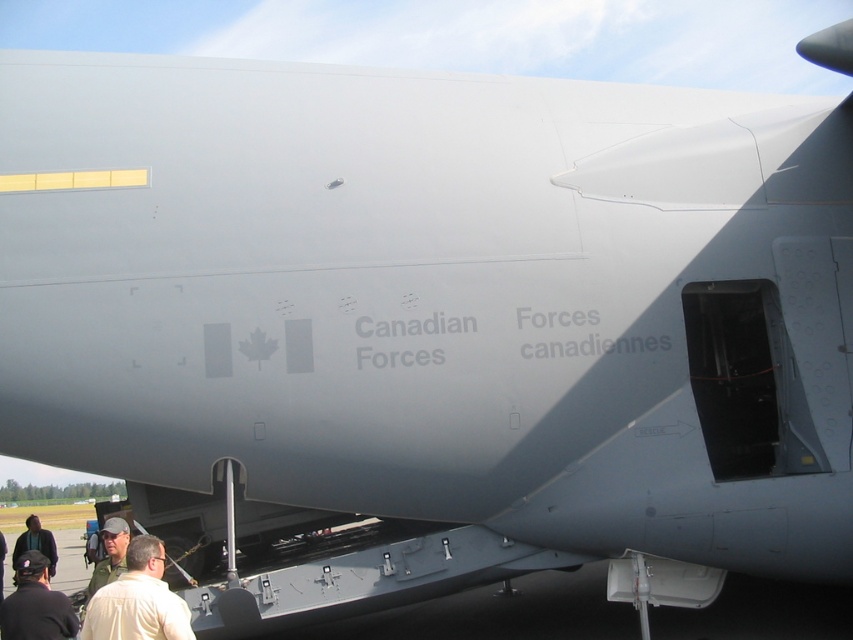
Looking at this image, does black fabric at lower left appear on the right side of camouflage fabric cap at lower left?

Incorrect, black fabric at lower left is not on the right side of camouflage fabric cap at lower left.

Is black fabric at lower left closer to camera compared to camouflage fabric cap at lower left?

That is True.

This screenshot has height=640, width=853. What do you see at coordinates (35, 604) in the screenshot? I see `black fabric at lower left` at bounding box center [35, 604].

Locate an element on the screen. This screenshot has width=853, height=640. black fabric at lower left is located at coordinates click(35, 604).

Is camouflage fabric cap at lower left positioned behind dark green jacket at lower left?

Answer: No, camouflage fabric cap at lower left is in front of dark green jacket at lower left.

Between point (88, 589) and point (42, 536), which one is positioned in front?

Point (88, 589) is more forward.

The width and height of the screenshot is (853, 640). In order to click on camouflage fabric cap at lower left in this screenshot , I will do `click(109, 554)`.

Is point (119, 554) farther from camera compared to point (0, 577)?

No, it is in front of (0, 577).

This screenshot has width=853, height=640. What do you see at coordinates (109, 554) in the screenshot? I see `camouflage fabric cap at lower left` at bounding box center [109, 554].

The height and width of the screenshot is (640, 853). What do you see at coordinates (109, 554) in the screenshot? I see `camouflage fabric cap at lower left` at bounding box center [109, 554].

Locate an element on the screen. camouflage fabric cap at lower left is located at coordinates (109, 554).